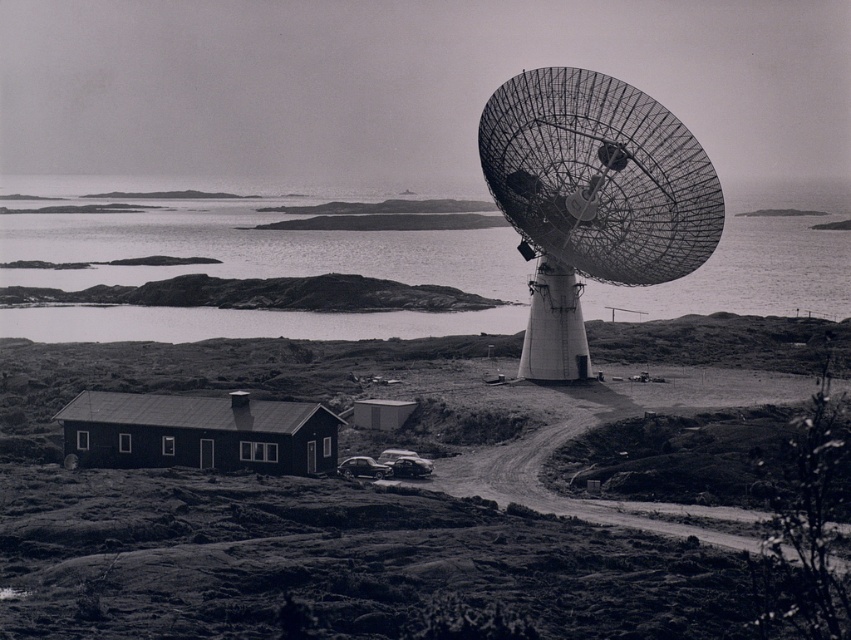
You are a delivery driver who needs to park your truck next to the shiny black car at center without blocking the metallic grid satellite at right. Is there enough space to park your truck there?

The metallic grid satellite at right is located above the shiny black car at center, so there is enough vertical space to park the truck next to the shiny black car at center without blocking the metallic grid satellite at right.

Looking at this image, you are standing at the satellite dish on the right side of the image. You want to find the point marked at coordinates point (253, 268). Which direction should you look to see it?

The point (253, 268) is on reflective silver water at upper center. Since you are at the satellite dish on the right side, you should look toward the upper center direction to see it.